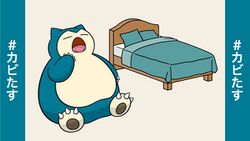
Locate an element on the screen. This screenshot has width=250, height=141. legs of the foot of the bed is located at coordinates (166, 86), (206, 78).